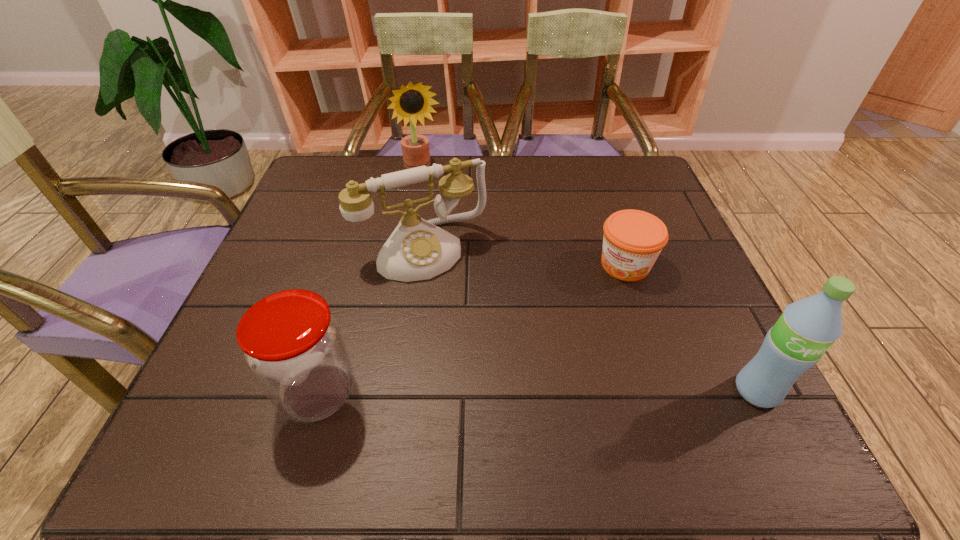
Locate an element on the screen. object that is at the left edge is located at coordinates (293, 345).

Where is `water bottle at the right edge`? This screenshot has width=960, height=540. water bottle at the right edge is located at coordinates tap(807, 328).

Where is `jam that is at the right edge`? The image size is (960, 540). jam that is at the right edge is located at coordinates (633, 239).

At what (x,y) coordinates should I click in order to perform the action: click on object situated at the near left corner. Please return your answer as a coordinate pair (x, y). Looking at the image, I should click on (293, 345).

The height and width of the screenshot is (540, 960). Find the location of `object at the near right corner`. object at the near right corner is located at coordinates (807, 328).

You are a GUI agent. You are given a task and a screenshot of the screen. Output one action in this format:
    pyautogui.click(x=<x>, y=<y>)
    Task: Click on the free space at the far edge
    This screenshot has width=960, height=540.
    Given the screenshot: What is the action you would take?
    (x=588, y=193)

The height and width of the screenshot is (540, 960). I want to click on free space at the near edge of the desktop, so click(613, 370).

You are a GUI agent. You are given a task and a screenshot of the screen. Output one action in this format:
    pyautogui.click(x=<x>, y=<y>)
    Task: Click on the vacant space at the left edge of the desktop
    The width and height of the screenshot is (960, 540).
    Given the screenshot: What is the action you would take?
    pyautogui.click(x=338, y=210)

I want to click on free space at the right edge, so click(x=658, y=270).

In the image, there is a desktop. Find the location of `free space at the far left corner`. free space at the far left corner is located at coordinates (369, 166).